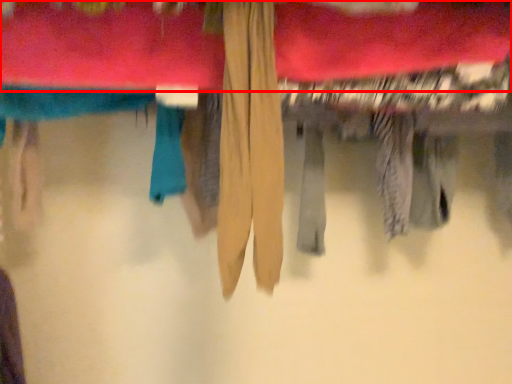
Question: From the image's perspective, what is the correct spatial relationship of towel (annotated by the red box) in relation to clothing?

Choices:
 (A) below
 (B) above

Answer: (B)